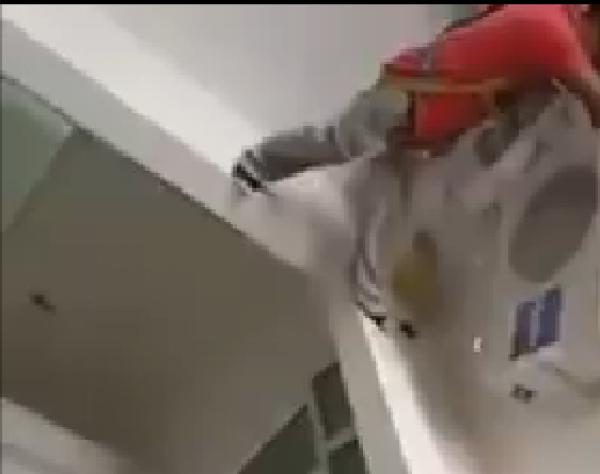
Locate an element on the screen. socket is located at coordinates (38, 301).